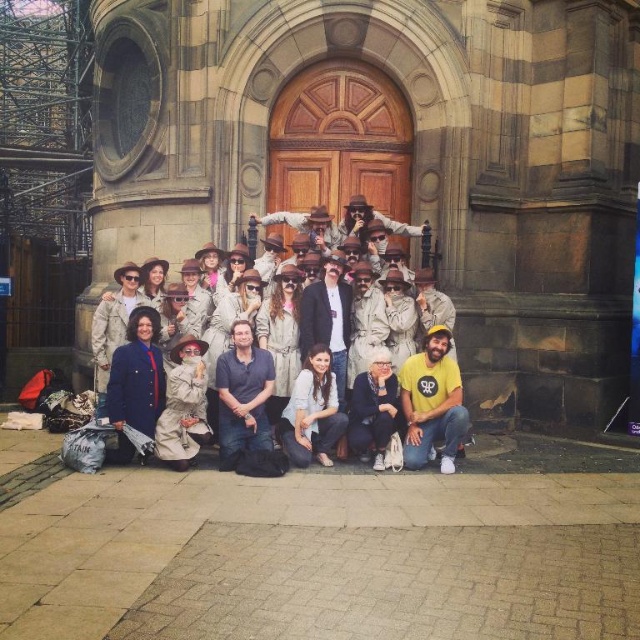
Question: Among these objects, which one is farthest from the camera?

Choices:
 (A) beige trench coat at center
 (B) smooth beige coat at center
 (C) yellow cotton t-shirt at lower center

Answer: (B)

Question: Is yellow cotton t-shirt at lower center positioned at the back of smooth beige coat at center?

Choices:
 (A) no
 (B) yes

Answer: (A)

Question: Which of the following is the farthest from the observer?

Choices:
 (A) beige trench coat at center
 (B) dark blue shirt at center

Answer: (A)

Question: Which point appears closest to the camera in this image?

Choices:
 (A) (220, 440)
 (B) (332, 332)
 (C) (465, 432)
 (D) (317, 240)

Answer: (C)

Question: Is yellow cotton t-shirt at lower center below dark blue shirt at center?

Choices:
 (A) no
 (B) yes

Answer: (A)

Question: Can you confirm if yellow cotton t-shirt at lower center is bigger than smooth beige coat at center?

Choices:
 (A) yes
 (B) no

Answer: (B)